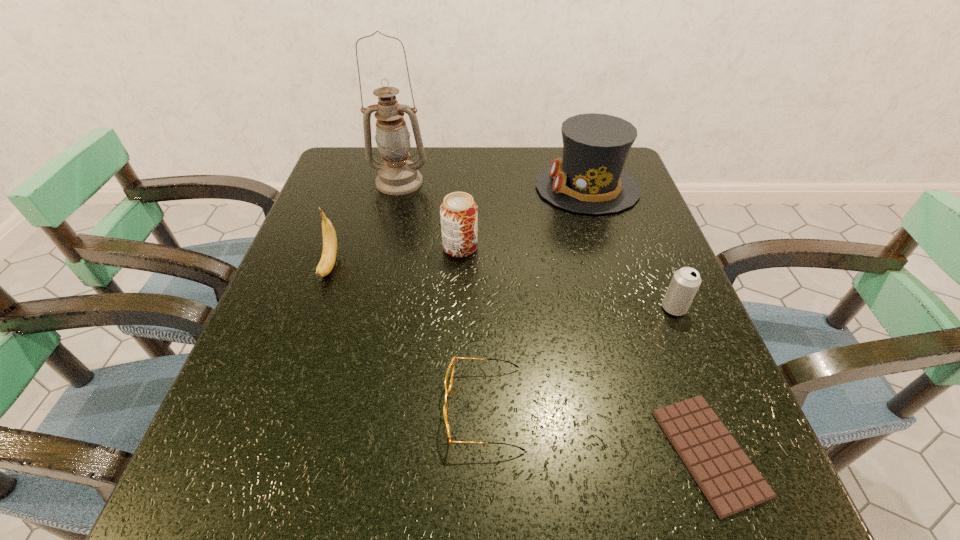
Image resolution: width=960 pixels, height=540 pixels. I want to click on free space located 0.090m on the right of the oil lamp, so click(x=462, y=182).

Locate an element on the screen. This screenshot has width=960, height=540. free space located with goggles on the front of the sixth shortest object is located at coordinates (478, 188).

The height and width of the screenshot is (540, 960). What are the coordinates of `vacant space located 0.100m with goggles on the front of the sixth shortest object` in the screenshot? It's located at (497, 188).

In order to click on vacant space located with goggles on the front of the sixth shortest object in this screenshot , I will do `click(456, 188)`.

Where is `vacant position located 0.080m on the front of the farther beer can`? This screenshot has width=960, height=540. vacant position located 0.080m on the front of the farther beer can is located at coordinates (459, 286).

The height and width of the screenshot is (540, 960). Find the location of `vacant space located 0.160m at the start of the peel on the banana`. vacant space located 0.160m at the start of the peel on the banana is located at coordinates (300, 350).

This screenshot has height=540, width=960. I want to click on vacant space located 0.070m on the back of the right beer can, so click(x=660, y=274).

The image size is (960, 540). Identify the location of vacant space located 0.240m on the front-facing side of the second shortest object. (298, 408).

Locate an element on the screen. The height and width of the screenshot is (540, 960). free space located 0.180m on the front-facing side of the second shortest object is located at coordinates (334, 408).

Where is `free space located 0.330m on the front-facing side of the second shortest object`? free space located 0.330m on the front-facing side of the second shortest object is located at coordinates pos(242,408).